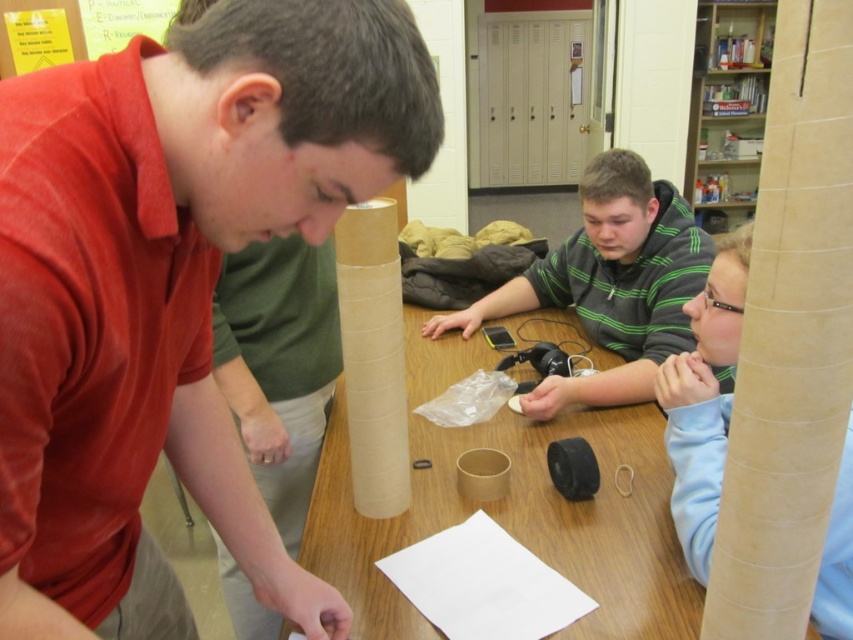
Question: Can you confirm if matte cardboard tube at right is wider than transparent plastic bag at center?

Choices:
 (A) yes
 (B) no

Answer: (A)

Question: Among these points, which one is farthest from the camera?

Choices:
 (A) (641, 168)
 (B) (347, 326)

Answer: (A)

Question: Which point is closer to the camera taking this photo?

Choices:
 (A) (384, 445)
 (B) (426, 406)

Answer: (A)

Question: In this image, where is matte cardboard tube at center located relative to green striped hoodie at center?

Choices:
 (A) above
 (B) below

Answer: (B)

Question: Can you confirm if green striped hoodie at center is wider than matte cardboard tube at right?

Choices:
 (A) yes
 (B) no

Answer: (A)

Question: Which point is closer to the camera?

Choices:
 (A) (0, 305)
 (B) (695, 554)
 (C) (462, 552)

Answer: (A)